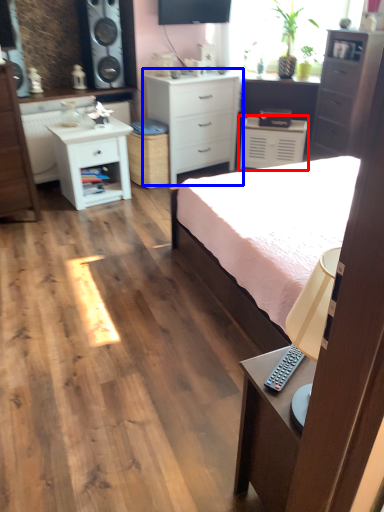
Question: Which object is further to the camera taking this photo, cabinetry (highlighted by a red box) or chest of drawers (highlighted by a blue box)?

Choices:
 (A) cabinetry
 (B) chest of drawers

Answer: (A)